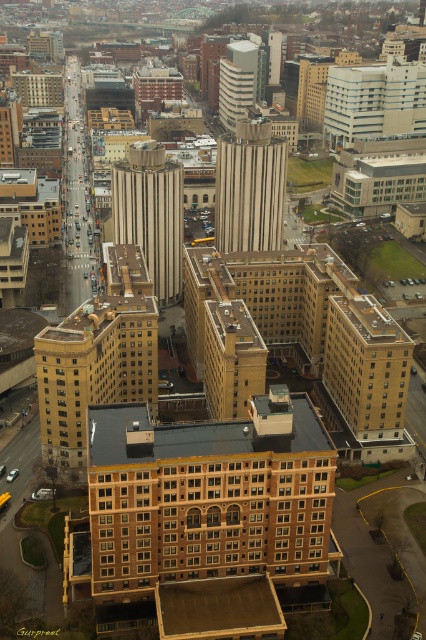
Question: Is white concrete building at upper right to the left of white smooth building at upper center from the viewer's perspective?

Choices:
 (A) no
 (B) yes

Answer: (A)

Question: Does striped concrete tower at center have a larger size compared to white smooth building at upper center?

Choices:
 (A) no
 (B) yes

Answer: (A)

Question: Which object appears closest to the camera in this image?

Choices:
 (A) beige stone tower at center
 (B) golden brick building at center
 (C) striped concrete tower at center

Answer: (B)

Question: Which object is the closest to the white concrete building at upper right?

Choices:
 (A) striped concrete tower at center
 (B) golden brick building at center

Answer: (A)

Question: Which point is farther from the camera taking this photo?

Choices:
 (A) (235, 124)
 (B) (264, 244)

Answer: (A)

Question: Is white concrete building at upper right further to camera compared to white smooth building at upper center?

Choices:
 (A) no
 (B) yes

Answer: (A)